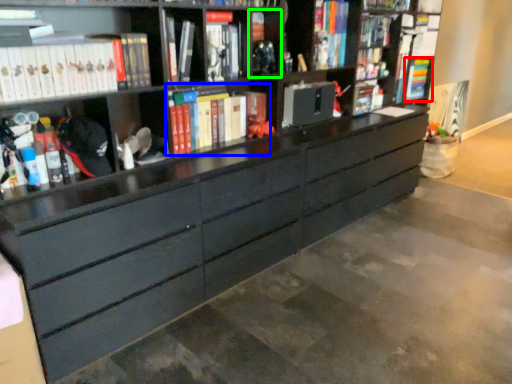
Question: Considering the real-world distances, which object is farthest from book (highlighted by a red box)? book (highlighted by a blue box) or cabinet (highlighted by a green box)?

Choices:
 (A) book
 (B) cabinet

Answer: (A)